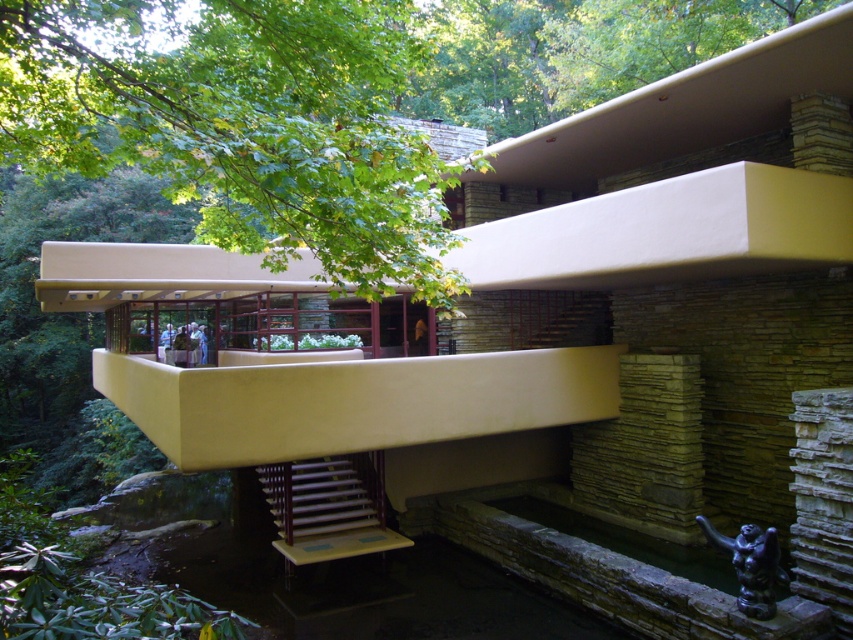
Question: Which point is closer to the camera?

Choices:
 (A) pyautogui.click(x=329, y=209)
 (B) pyautogui.click(x=318, y=502)

Answer: (A)

Question: Which of the following is the closest to the observer?

Choices:
 (A) wooden stairs at center
 (B) green leafy tree at upper left

Answer: (B)

Question: Which of the following is the farthest from the observer?

Choices:
 (A) (351, 132)
 (B) (338, 499)

Answer: (B)

Question: Observing the image, what is the correct spatial positioning of green leafy tree at upper left in reference to wooden stairs at center?

Choices:
 (A) below
 (B) above

Answer: (B)

Question: Is green leafy tree at upper left positioned before wooden stairs at center?

Choices:
 (A) no
 (B) yes

Answer: (B)

Question: Does green leafy tree at upper left appear on the left side of wooden stairs at center?

Choices:
 (A) yes
 (B) no

Answer: (B)